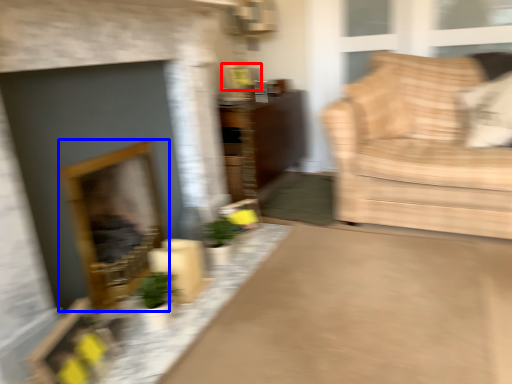
Question: Among these objects, which one is farthest to the camera, picture frame (highlighted by a red box) or fireplace (highlighted by a blue box)?

Choices:
 (A) picture frame
 (B) fireplace

Answer: (A)